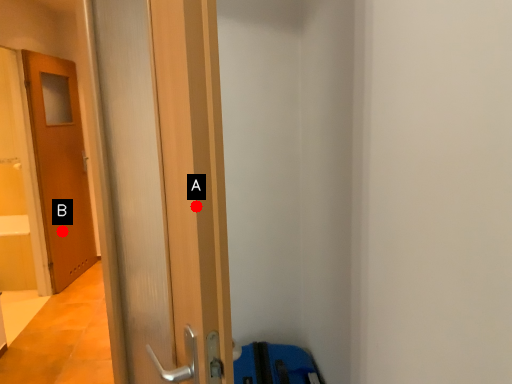
Question: Two points are circled on the image, labeled by A and B beside each circle. Which point is farther from the camera taking this photo?

Choices:
 (A) A is further
 (B) B is further

Answer: (B)